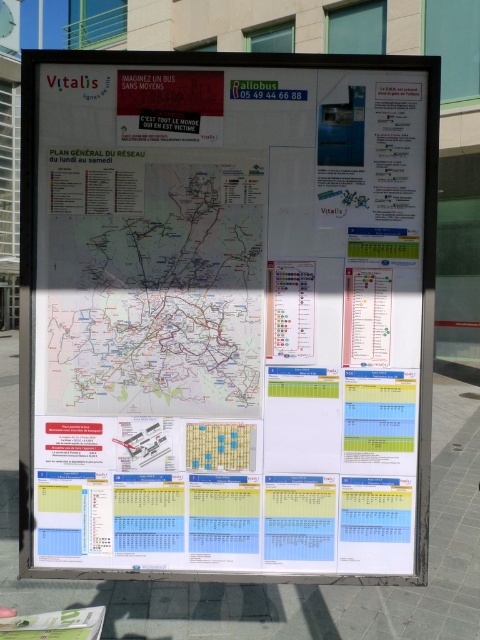
Question: Does white paperboard at center have a larger size compared to white paper map at center?

Choices:
 (A) no
 (B) yes

Answer: (B)

Question: Among these points, which one is nearest to the camera?

Choices:
 (A) (73, 264)
 (B) (113, 216)

Answer: (B)

Question: Is white paperboard at center wider than white paper map at center?

Choices:
 (A) yes
 (B) no

Answer: (A)

Question: Does white paperboard at center lie behind white paper map at center?

Choices:
 (A) yes
 (B) no

Answer: (B)